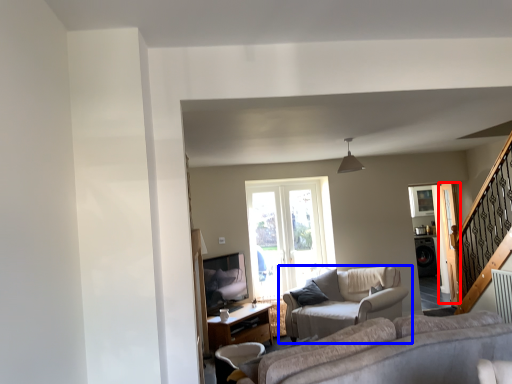
Question: Among these objects, which one is nearest to the camera, screen door (highlighted by a red box) or studio couch (highlighted by a blue box)?

Choices:
 (A) screen door
 (B) studio couch

Answer: (B)